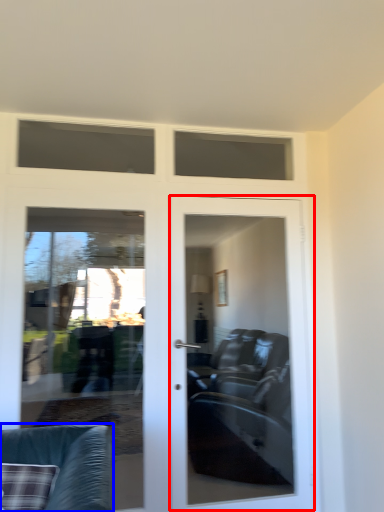
Question: Among these objects, which one is farthest to the camera, door (highlighted by a red box) or chair (highlighted by a blue box)?

Choices:
 (A) door
 (B) chair

Answer: (A)